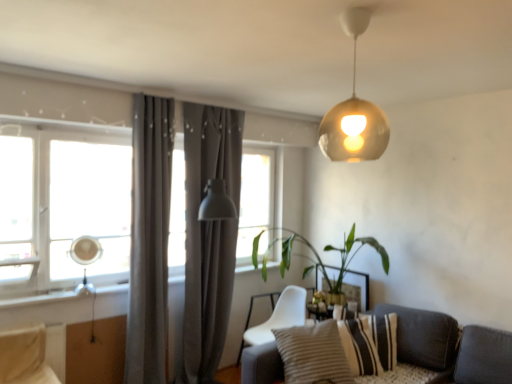
This screenshot has width=512, height=384. I want to click on vacant area on top of matte silver table lamp at left (from a real-world perspective), so click(x=84, y=235).